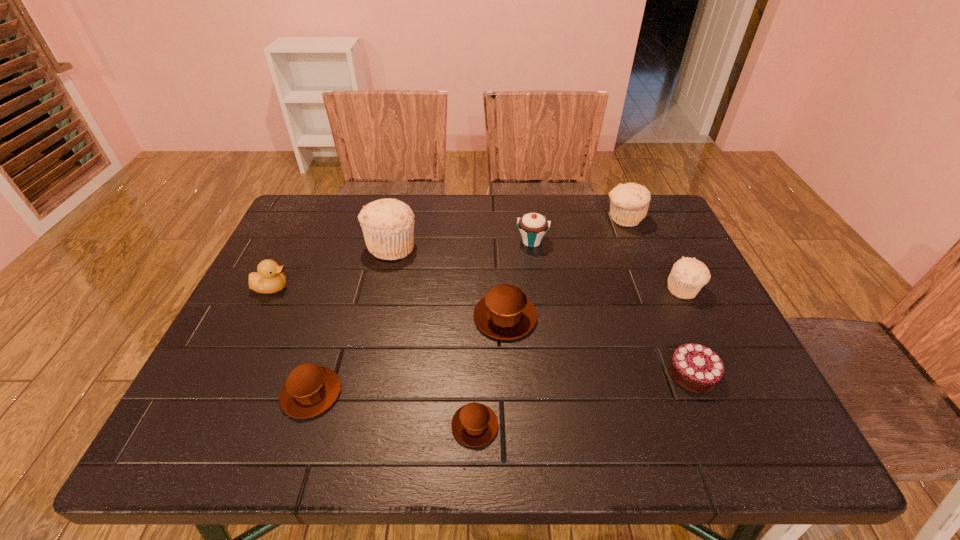
The width and height of the screenshot is (960, 540). Identify the location of vacant space located 0.050m on the front of the chocolate chocolate cake. (710, 417).

You are a GUI agent. You are given a task and a screenshot of the screen. Output one action in this format:
    pyautogui.click(x=<x>, y=<y>)
    Task: Click on the free spot located on the left of the shortest object
    
    Given the screenshot: What is the action you would take?
    pyautogui.click(x=331, y=426)

Locate an element on the screen. This screenshot has width=960, height=540. cupcake located at the far edge is located at coordinates (532, 226).

Identify the location of object at the left edge. [270, 279].

Find the location of a particular element. chocolate cake at the right edge is located at coordinates point(696,368).

Locate an element on the screen. The width and height of the screenshot is (960, 540). object present at the far right corner is located at coordinates (629, 203).

Find the location of a particular element. This screenshot has height=540, width=960. vacant area at the far edge of the desktop is located at coordinates pos(595,224).

Where is `free point at the near edge`? The image size is (960, 540). free point at the near edge is located at coordinates (618, 424).

Where is `vacant area at the left edge of the desktop`? vacant area at the left edge of the desktop is located at coordinates (304, 287).

In order to click on free space at the right edge of the desktop in this screenshot , I will do `click(722, 327)`.